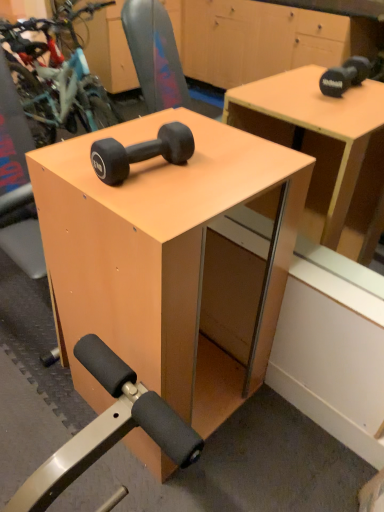
Where is `matte black dumbbell at center`? matte black dumbbell at center is located at coordinates (141, 152).

Measure the distance between matte black dumbbell at center and camera.

33.46 inches.

This screenshot has height=512, width=384. What do you see at coordinates (141, 152) in the screenshot?
I see `matte black dumbbell at center` at bounding box center [141, 152].

Locate an element on the screen. The width and height of the screenshot is (384, 512). matte wood dumbbell at center is located at coordinates (x=162, y=259).

Image resolution: width=384 pixels, height=512 pixels. What do you see at coordinates (162, 259) in the screenshot? I see `matte wood dumbbell at center` at bounding box center [162, 259].

Image resolution: width=384 pixels, height=512 pixels. Find the location of `matte black dumbbell at center`. matte black dumbbell at center is located at coordinates (141, 152).

Is matte wood dumbbell at center to the right of matte black dumbbell at center from the viewer's perspective?

Correct, you'll find matte wood dumbbell at center to the right of matte black dumbbell at center.

Is the depth of matte wood dumbbell at center less than that of matte black dumbbell at center?

Yes, it is.

Which is in front, point (254, 324) or point (156, 144)?

The point (156, 144) is in front.

From the image's perspective, relative to matte black dumbbell at center, is matte wood dumbbell at center above or below?

From the image's perspective, matte wood dumbbell at center appears below matte black dumbbell at center.

From a real-world perspective, is matte wood dumbbell at center located beneath matte black dumbbell at center?

Yes.

Is matte wood dumbbell at center wider than matte black dumbbell at center?

Indeed, matte wood dumbbell at center has a greater width compared to matte black dumbbell at center.

In the scene shown: Which of these two, matte wood dumbbell at center or matte black dumbbell at center, stands shorter?

matte black dumbbell at center is shorter.

Can you confirm if matte wood dumbbell at center is bigger than matte black dumbbell at center?

Yes.

In the scene shown: Is matte wood dumbbell at center completely or partially outside of matte black dumbbell at center?

Yes, matte wood dumbbell at center is located beyond the bounds of matte black dumbbell at center.

Are matte wood dumbbell at center and matte black dumbbell at center making contact?

matte wood dumbbell at center and matte black dumbbell at center are clearly separated.

Is matte black dumbbell at center at the back of matte wood dumbbell at center?

No, matte wood dumbbell at center's orientation is not away from matte black dumbbell at center.

Can you tell me how much matte wood dumbbell at center and matte black dumbbell at center differ in facing direction?

They differ by 1.64 degrees in their facing directions.

Identify the location of dumbbell that is above the matte wood dumbbell at center (from the image's perspective). Image resolution: width=384 pixels, height=512 pixels. (141, 152).

Visually, is matte black dumbbell at center positioned to the left or to the right of matte wood dumbbell at center?

Based on their positions, matte black dumbbell at center is located to the left of matte wood dumbbell at center.

Which is in front, matte black dumbbell at center or matte wood dumbbell at center?

matte wood dumbbell at center is closer to the camera.

Which is in front, point (110, 151) or point (156, 188)?

The point (110, 151) is closer to the camera.

From the image's perspective, between matte black dumbbell at center and matte wood dumbbell at center, which one is located above?

matte black dumbbell at center appears higher in the image.

From a real-world perspective, which object stands above the other?

From a 3D spatial view, matte black dumbbell at center is above.

Is matte black dumbbell at center thinner than matte wood dumbbell at center?

Yes, matte black dumbbell at center is thinner than matte wood dumbbell at center.

Between matte black dumbbell at center and matte wood dumbbell at center, which one has less height?

With less height is matte black dumbbell at center.

Considering the sizes of objects matte black dumbbell at center and matte wood dumbbell at center in the image provided, who is bigger, matte black dumbbell at center or matte wood dumbbell at center?

matte wood dumbbell at center is bigger.

Is matte black dumbbell at center surrounding matte wood dumbbell at center?

No, matte wood dumbbell at center is located outside of matte black dumbbell at center.

Are matte black dumbbell at center and matte wood dumbbell at center far apart?

No, matte black dumbbell at center is in close proximity to matte wood dumbbell at center.

Could you tell me if matte black dumbbell at center is turned towards matte wood dumbbell at center?

No, matte black dumbbell at center is not turned towards matte wood dumbbell at center.

How much distance is there between matte black dumbbell at center and matte wood dumbbell at center?

matte black dumbbell at center is 13.42 inches from matte wood dumbbell at center.

Find the location of a particular element. This screenshot has height=512, width=384. table below the matte black dumbbell at center (from a real-world perspective) is located at coordinates (162, 259).

You are a GUI agent. You are given a task and a screenshot of the screen. Output one action in this format:
    pyautogui.click(x=<x>, y=<y>)
    Task: Click on the table on the right of matte black dumbbell at center
    The image size is (384, 512).
    Given the screenshot: What is the action you would take?
    pyautogui.click(x=162, y=259)

This screenshot has width=384, height=512. I want to click on table below the matte black dumbbell at center (from a real-world perspective), so click(x=162, y=259).